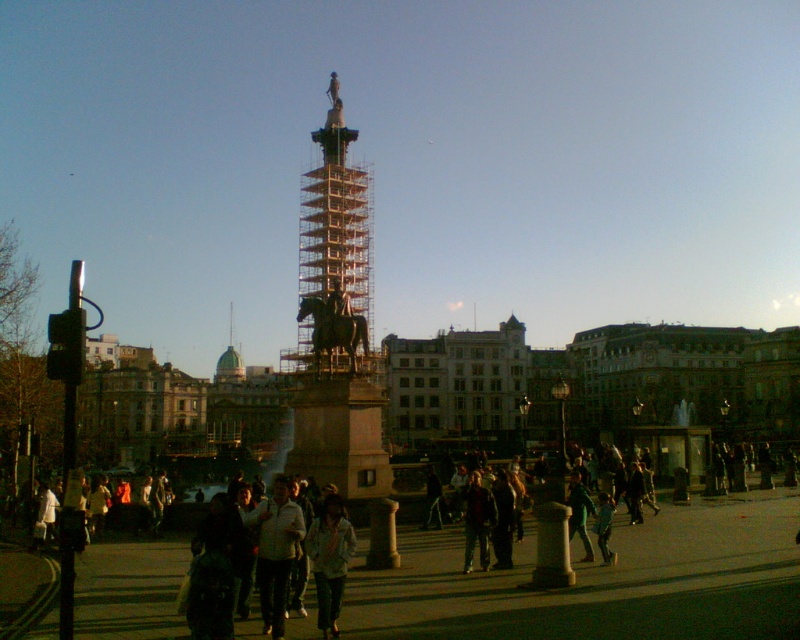
You are a photographer trying to capture a photo of the equestrian statue. You notice the scaffolding metal tower at center and the light blue denim jacket at center in your frame. Which object should you adjust your camera angle to avoid if you want to focus on the statue without obstructions?

The scaffolding metal tower at center should be adjusted because it is wider than the light blue denim jacket at center, making it more likely to obstruct the view of the statue.

You are standing in the public square and want to take a photo of the equestrian statue without the scaffolding metal tower at center obstructing the view. Where should you position yourself relative to the statue to ensure the tower is out of frame?

To avoid the scaffolding metal tower at center obstructing the view, position yourself at a point opposite to its location at point (x=337, y=324) relative to the statue. This will place the tower outside your camera frame, allowing a clear view of the equestrian statue.